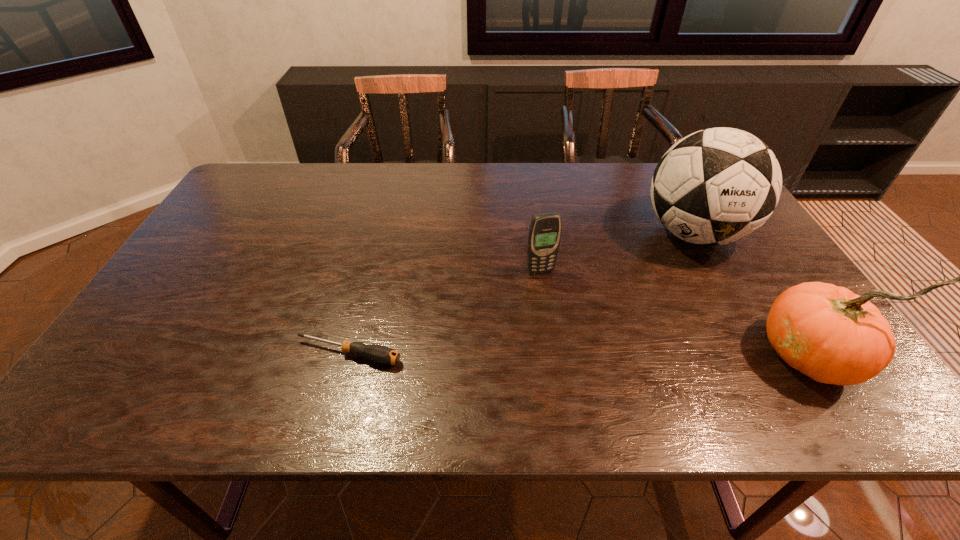
The height and width of the screenshot is (540, 960). I want to click on free area in between the soccer ball and the shortest object, so click(521, 294).

Identify the location of empty space that is in between the second shortest object and the soccer ball. The image size is (960, 540). (617, 253).

Locate an element on the screen. The image size is (960, 540). free space between the leftmost object and the pumpkin is located at coordinates (580, 354).

Where is `object that ranks as the closest to the cellular telephone`? object that ranks as the closest to the cellular telephone is located at coordinates (719, 185).

At what (x,y) coordinates should I click in order to perform the action: click on object that is the third closest to the soccer ball. Please return your answer as a coordinate pair (x, y). Looking at the image, I should click on (380, 354).

Where is `free space that satisfies the following two spatial constraints: 1. on the front side of the pumpkin; 2. on the left side of the leftmost object`? This screenshot has width=960, height=540. free space that satisfies the following two spatial constraints: 1. on the front side of the pumpkin; 2. on the left side of the leftmost object is located at coordinates [348, 355].